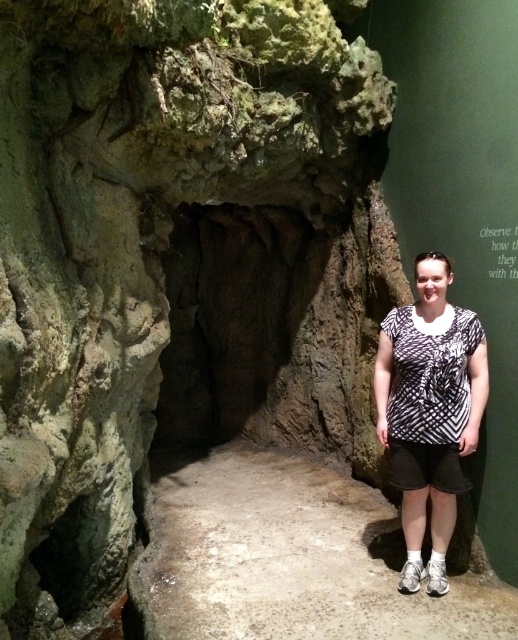
From the picture: Does printed fabric shirt at center have a larger size compared to black and white printed shirt at center?

Correct, printed fabric shirt at center is larger in size than black and white printed shirt at center.

Can you confirm if printed fabric shirt at center is taller than black and white printed shirt at center?

Indeed, printed fabric shirt at center has a greater height compared to black and white printed shirt at center.

Describe the element at coordinates (429, 412) in the screenshot. I see `printed fabric shirt at center` at that location.

This screenshot has width=518, height=640. Identify the location of printed fabric shirt at center. (x=429, y=412).